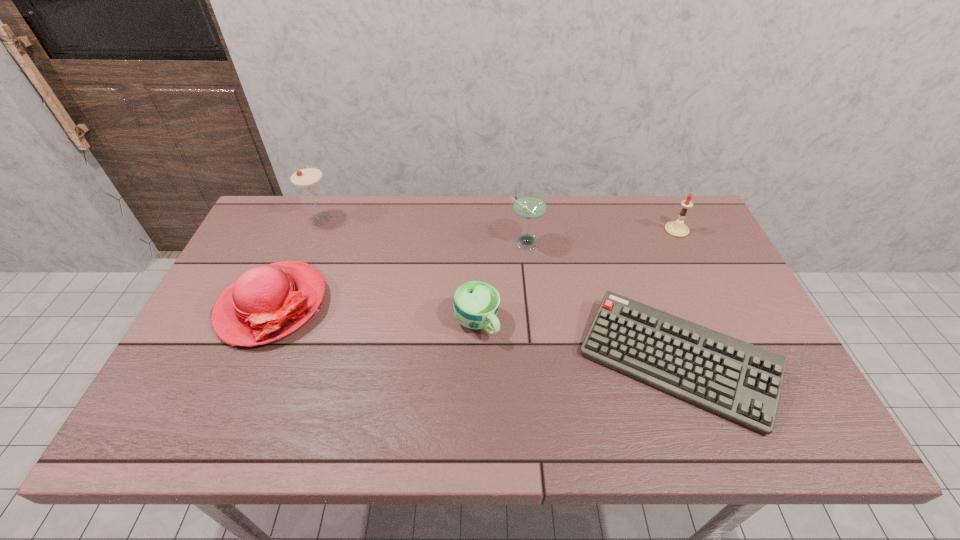
Where is `object that is at the far left corner`? object that is at the far left corner is located at coordinates (307, 178).

Find the location of `object that is at the far right corner`. object that is at the far right corner is located at coordinates (677, 228).

Image resolution: width=960 pixels, height=540 pixels. I want to click on object present at the near right corner, so click(x=740, y=381).

Find the location of a particular element. This screenshot has height=540, width=960. free space at the far edge of the desktop is located at coordinates (557, 232).

In the image, there is a desktop. At what (x,y) coordinates should I click in order to perform the action: click on free space at the near edge. Please return your answer as a coordinate pair (x, y). Image resolution: width=960 pixels, height=540 pixels. Looking at the image, I should click on (673, 422).

I want to click on free spot at the far left corner of the desktop, so click(x=284, y=214).

Locate an element on the screen. free space between the computer keyboard and the candle is located at coordinates (677, 296).

Where is `free space between the computer keyboard and the candle`? Image resolution: width=960 pixels, height=540 pixels. free space between the computer keyboard and the candle is located at coordinates click(x=677, y=296).

Identify the location of free spot between the candle and the farther martini. (498, 224).

Identify the location of free point between the hat and the computer keyboard. This screenshot has height=540, width=960. (474, 334).